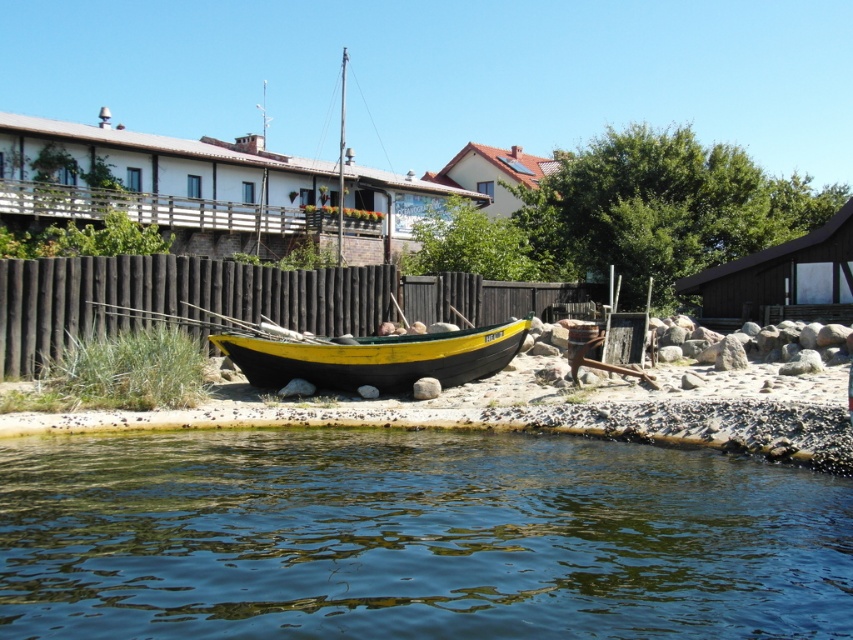
Who is more distant from viewer, (x=728, y=616) or (x=285, y=374)?

Positioned behind is point (x=285, y=374).

Is transparent water at lower center to the left of yellow-green painted wood canoe at center from the viewer's perspective?

In fact, transparent water at lower center is to the right of yellow-green painted wood canoe at center.

Does point (149, 442) lie behind point (389, 356)?

That is False.

Find the location of a particular element. transparent water at lower center is located at coordinates (415, 538).